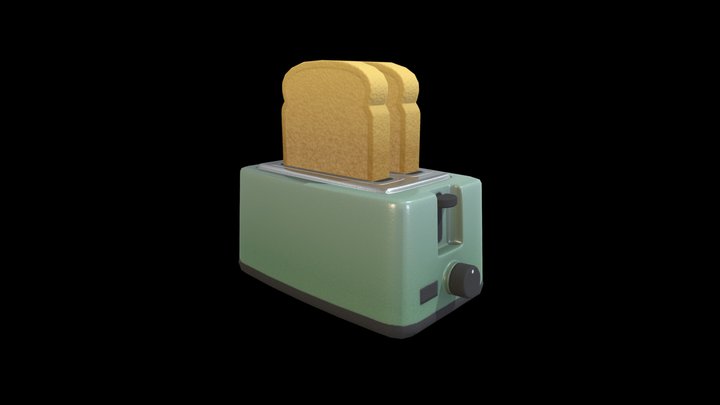
Image resolution: width=720 pixels, height=405 pixels. In order to click on knob in this screenshot , I will do `click(456, 279)`.